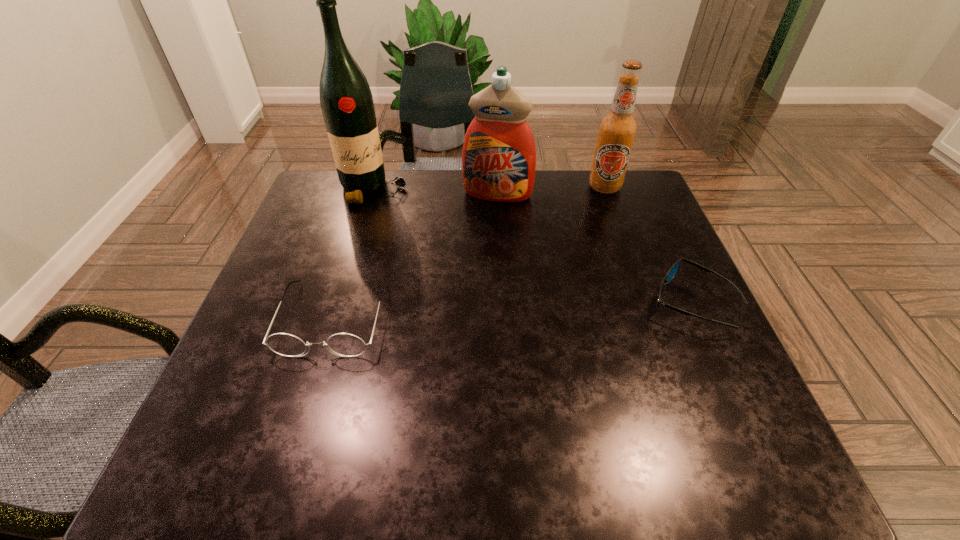
Find the location of a particular element. Image resolution: width=960 pixels, height=540 pixels. object that stands as the third closest to the third object from right to left is located at coordinates (344, 344).

In order to click on object that is the fourth closest one to the third object from left to right in this screenshot , I will do `click(672, 272)`.

You are a GUI agent. You are given a task and a screenshot of the screen. Output one action in this format:
    pyautogui.click(x=<x>, y=<y>)
    Task: Click on the vacant point that satisfies the following two spatial constraints: 1. on the front side of the beer bottle; 2. at the front of the shortest object showing the lenses
    The height and width of the screenshot is (540, 960).
    Given the screenshot: What is the action you would take?
    pyautogui.click(x=646, y=302)

I want to click on vacant space that satisfies the following two spatial constraints: 1. on the front side of the beer bottle; 2. at the front of the shortest object showing the lenses, so click(x=646, y=302).

The image size is (960, 540). What are the coordinates of `vacant position in the image that satisfies the following two spatial constraints: 1. on the front side of the detergent; 2. at the front of the sunglasses showing the lenses` in the screenshot? It's located at (503, 302).